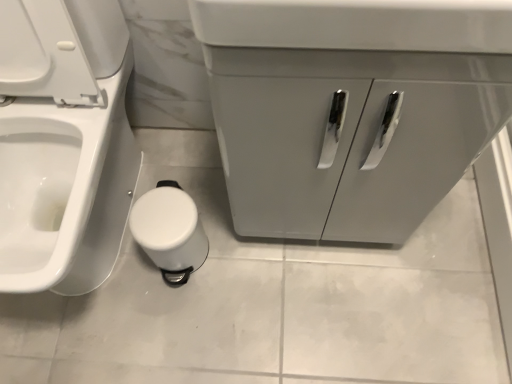
The width and height of the screenshot is (512, 384). Find the location of `vacant space to the right of white glossy toilet at lower left`. vacant space to the right of white glossy toilet at lower left is located at coordinates (229, 243).